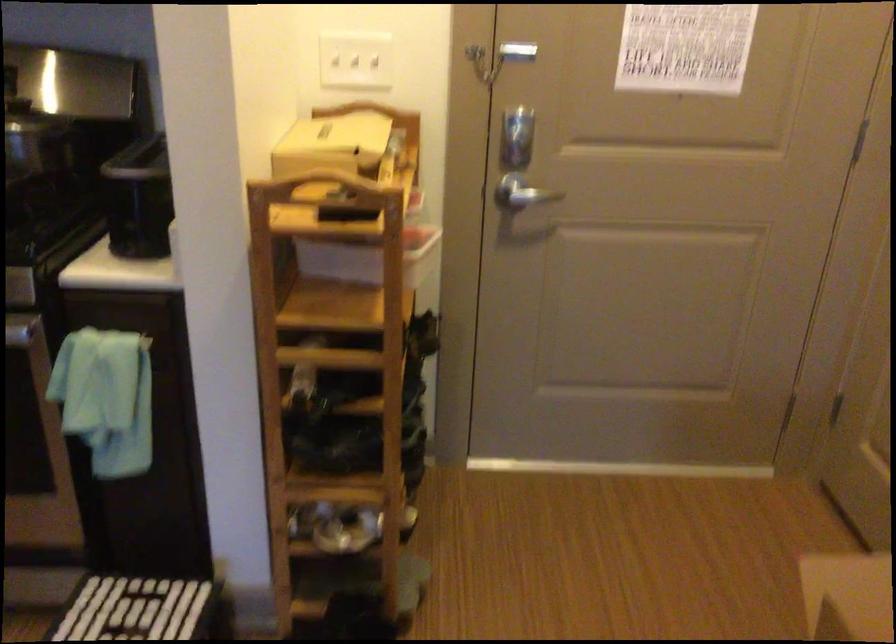
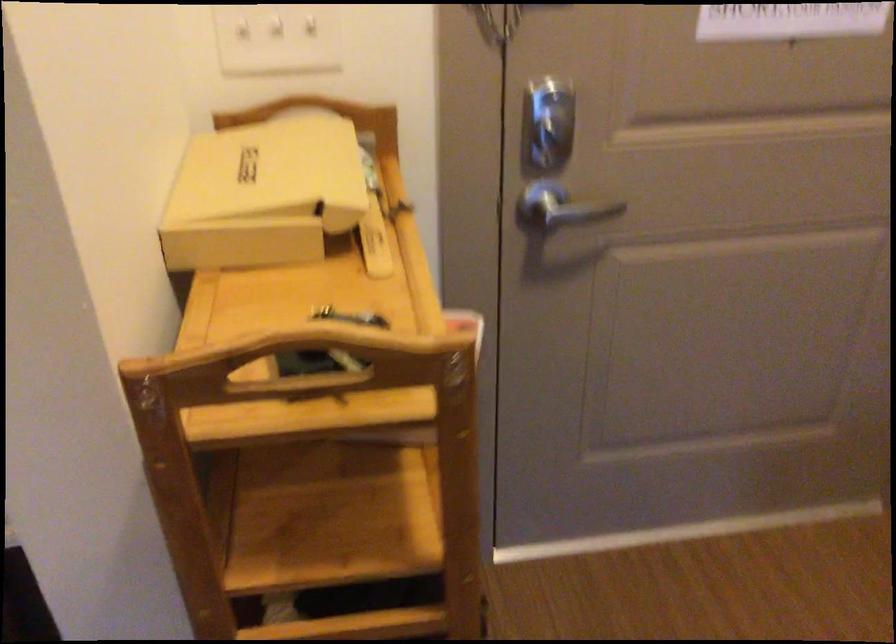
The point at (323, 202) is marked in the first image. Where is the corresponding point in the second image?

(300, 364)